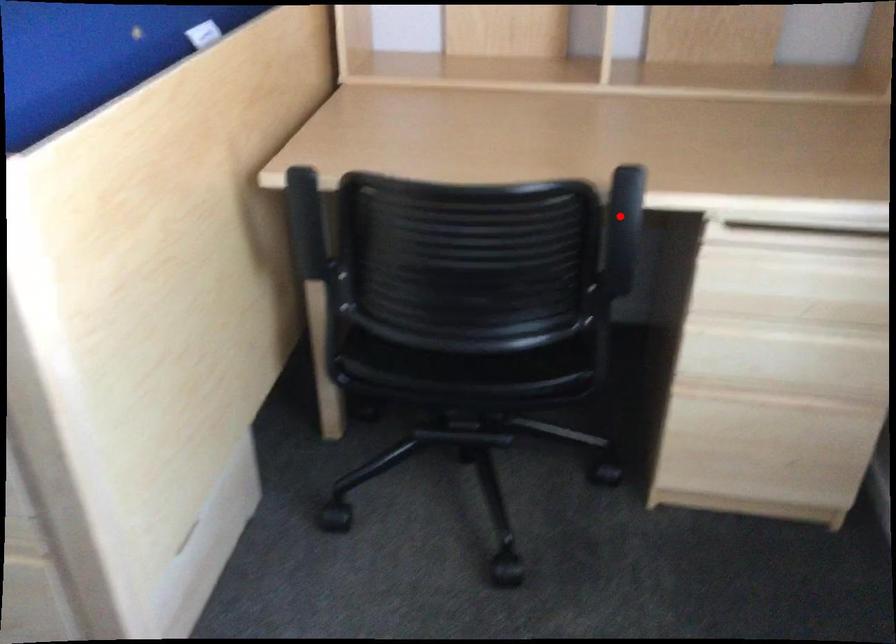
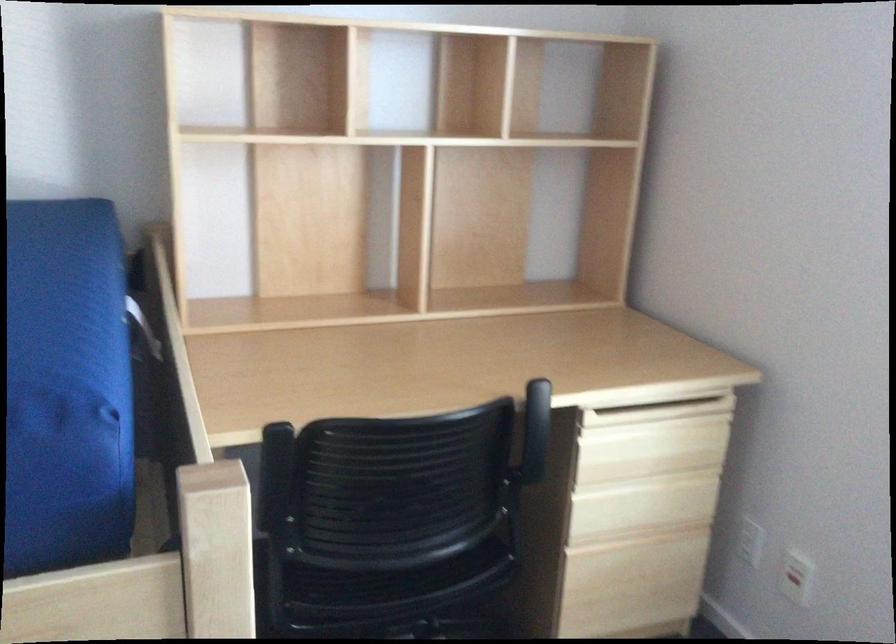
Question: I am providing you with two images of the same scene from different viewpoints. Given a red point in image1, look at the same physical point in image2. Is it:

Choices:
 (A) Closer to the viewpoint
 (B) Farther from the viewpoint

Answer: (B)